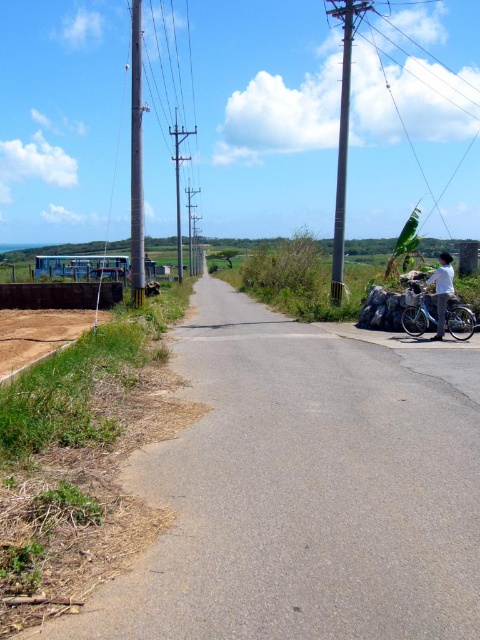
Consider the image. Can you confirm if white matte shirt at right is positioned above smooth gray telegraph pole at center?

No.

Who is more distant from viewer, (428, 278) or (177, 170)?

The point (177, 170) is more distant.

Image resolution: width=480 pixels, height=640 pixels. Find the location of `white matte shirt at right`. white matte shirt at right is located at coordinates (442, 291).

Does smooth gray pole at left appear over smooth gray telegraph pole at center?

Yes, smooth gray pole at left is above smooth gray telegraph pole at center.

Is smooth gray pole at left closer to camera compared to smooth gray telegraph pole at center?

Yes, it is in front of smooth gray telegraph pole at center.

Locate an element on the screen. smooth gray pole at left is located at coordinates (136, 157).

In the scene shown: Does green plastic pole at upper right appear on the right side of white matte shirt at right?

Correct, you'll find green plastic pole at upper right to the right of white matte shirt at right.

Is point (391, 28) positioned in front of point (444, 316)?

No.

Is point (445, 102) behind point (446, 253)?

Yes, it is behind point (446, 253).

Locate an element on the screen. The height and width of the screenshot is (640, 480). green plastic pole at upper right is located at coordinates (425, 90).